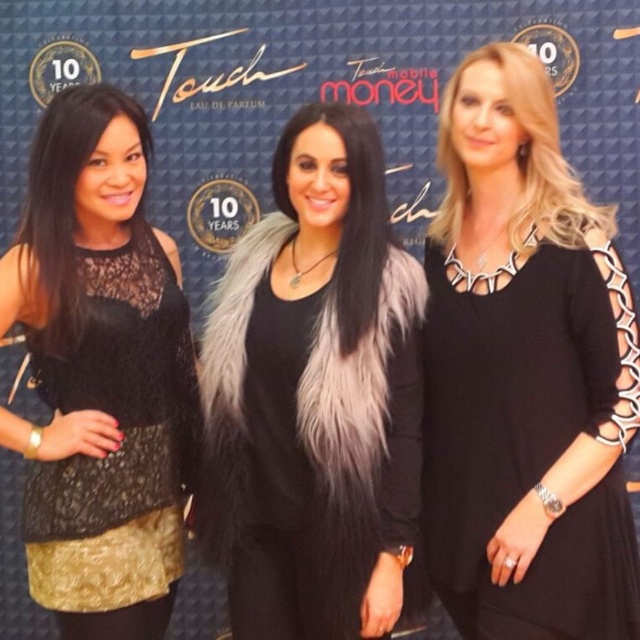
Is fuzzy fur vest at center to the left of black lace top at left from the viewer's perspective?

No, fuzzy fur vest at center is not to the left of black lace top at left.

Which of these two, fuzzy fur vest at center or black lace top at left, stands shorter?

Standing shorter between the two is fuzzy fur vest at center.

This screenshot has width=640, height=640. I want to click on fuzzy fur vest at center, so pos(314,396).

Between black matte dress at center and fuzzy fur vest at center, which one is positioned higher?

black matte dress at center

Is point (529, 307) farther from viewer compared to point (298, 429)?

Yes, point (529, 307) is behind point (298, 429).

Locate an element on the screen. This screenshot has height=640, width=640. black matte dress at center is located at coordinates (525, 372).

Does point (557, 560) lie behind point (54, 572)?

No, it is not.

Is black matte dress at center thinner than black lace top at left?

No.

The height and width of the screenshot is (640, 640). Find the location of `black matte dress at center`. black matte dress at center is located at coordinates (525, 372).

The width and height of the screenshot is (640, 640). I want to click on black matte dress at center, so click(525, 372).